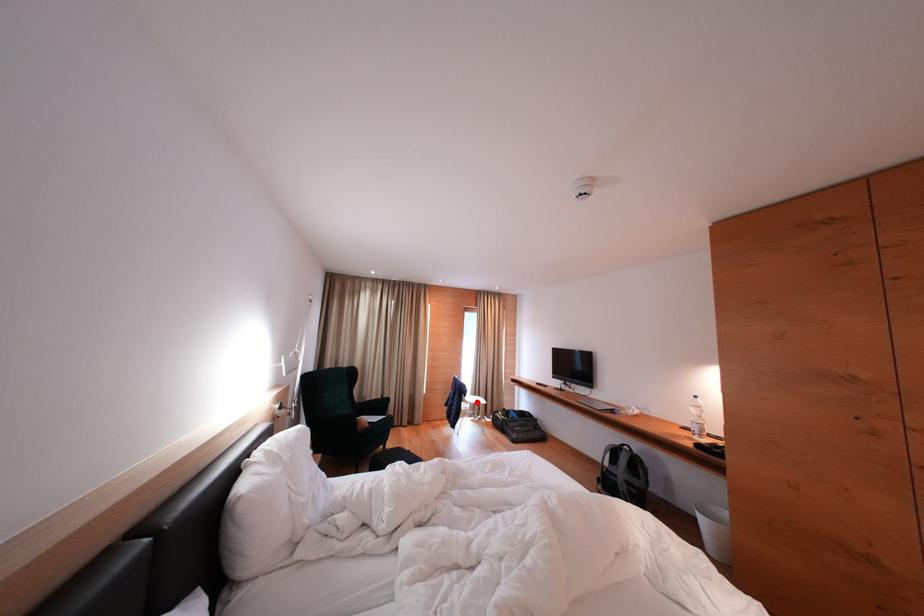
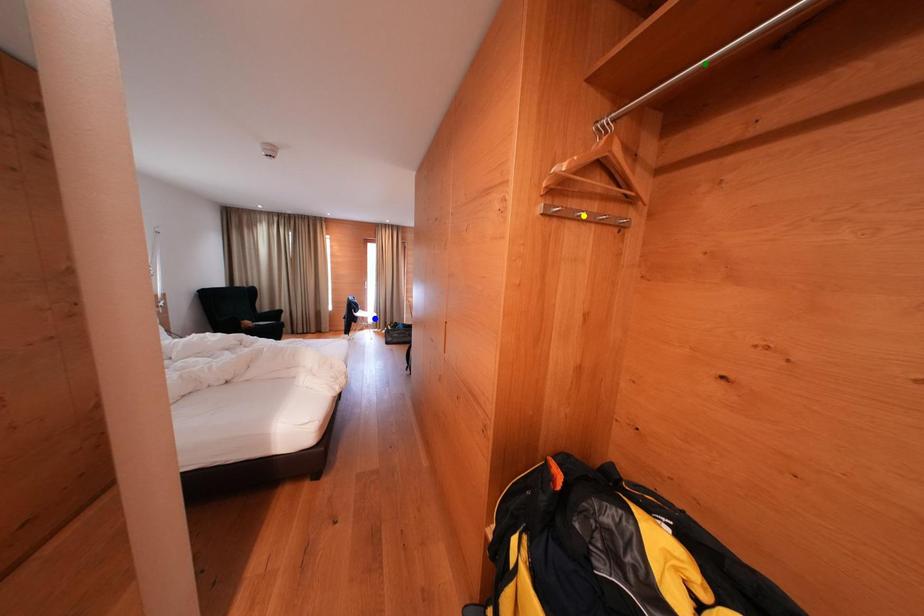
Question: I am providing you with two images of the same scene from different viewpoints. A red point is marked on the first image. You are given multiple points on the second image. Can you choose the point in image 2 that corresponds to the point in image 1?

Choices:
 (A) yellow point
 (B) green point
 (C) blue point

Answer: (C)